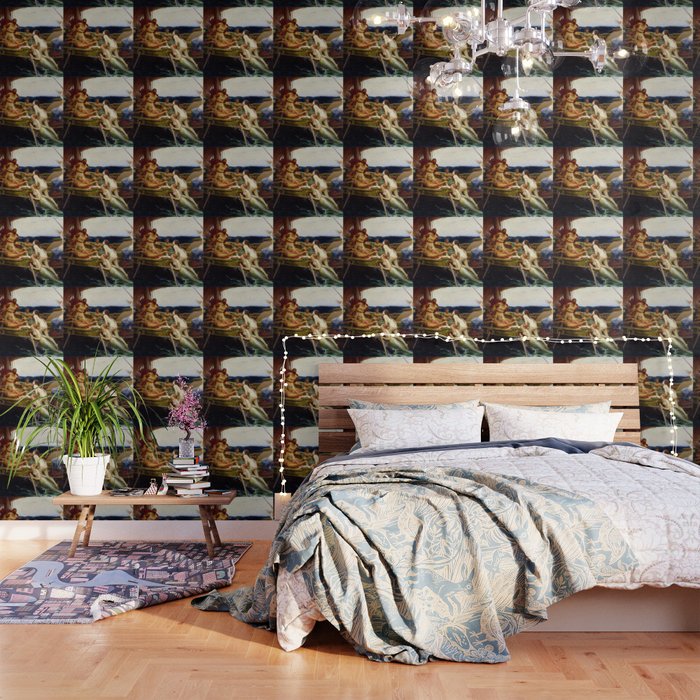
Locate an element on the screen. Image resolution: width=700 pixels, height=700 pixels. wallpaper is located at coordinates (234, 259).